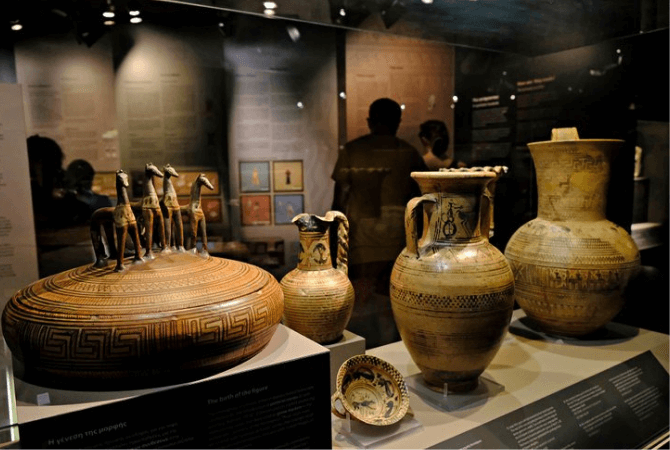
Locate an element on the screen. The width and height of the screenshot is (670, 450). right ceramic vase is located at coordinates (573, 208).